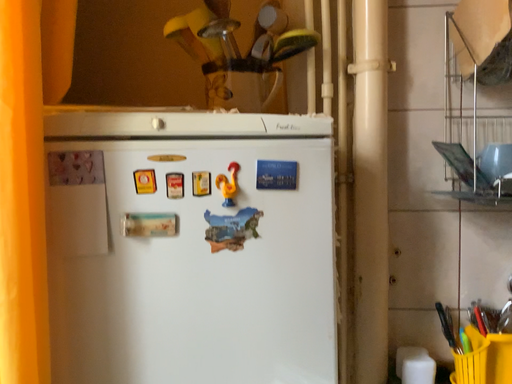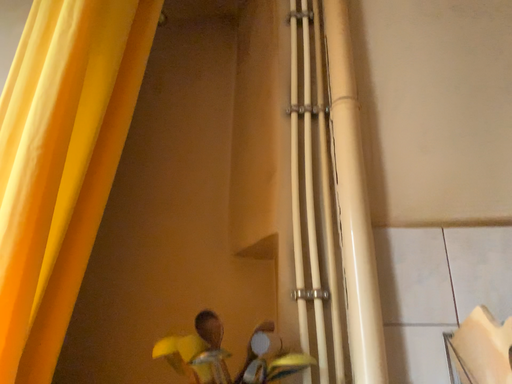
Question: How did the camera likely rotate when shooting the video?

Choices:
 (A) rotated upward
 (B) rotated downward

Answer: (A)